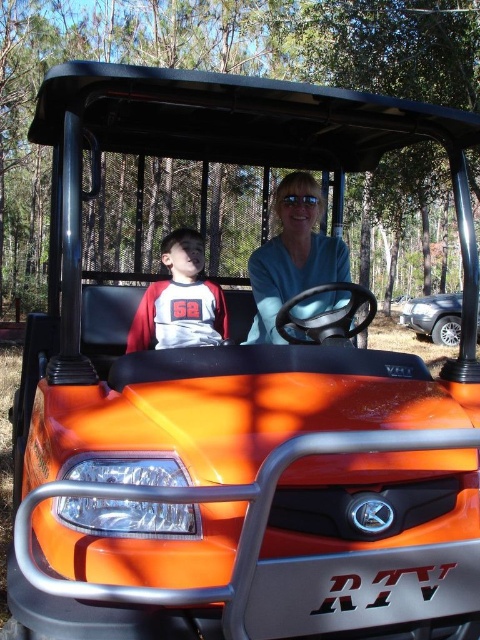
Between point (197, 342) and point (408, 312), which one is positioned behind?

Point (408, 312)

Based on the photo, who is higher up, red jersey at center or silver metallic suv at right?

red jersey at center is above.

Does point (153, 339) come farther from viewer compared to point (453, 323)?

No, it is in front of (453, 323).

Identify the location of red jersey at center. click(180, 300).

Is blue matte shirt at center shorter than red jersey at center?

In fact, blue matte shirt at center may be taller than red jersey at center.

Is blue matte shirt at center thinner than red jersey at center?

No.

Does point (313, 218) lie in front of point (186, 289)?

Yes, point (313, 218) is closer to viewer.

Find the location of a particular element. blue matte shirt at center is located at coordinates (292, 256).

Does blue matte shirt at center appear on the right side of silver metallic suv at right?

No, blue matte shirt at center is not to the right of silver metallic suv at right.

Locate an element on the screen. blue matte shirt at center is located at coordinates (292, 256).